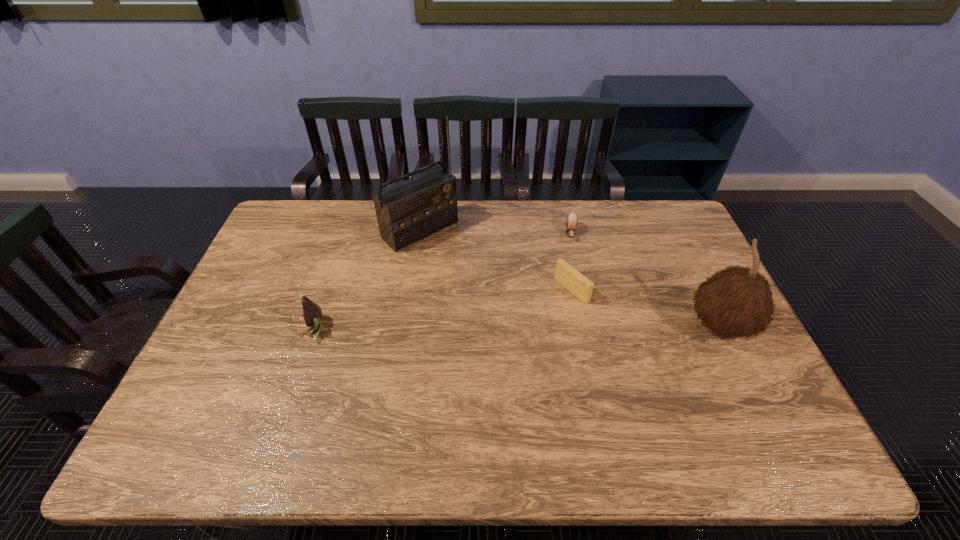
What are the coordinates of `vacant point that satisfies the following two spatial constraints: 1. on the front side of the tallest object; 2. on the surface of the rightmost object` in the screenshot? It's located at (406, 326).

The height and width of the screenshot is (540, 960). What are the coordinates of `vacant space that satisfies the following two spatial constraints: 1. on the front side of the second tallest object; 2. on the surface of the videotape` in the screenshot? It's located at (579, 326).